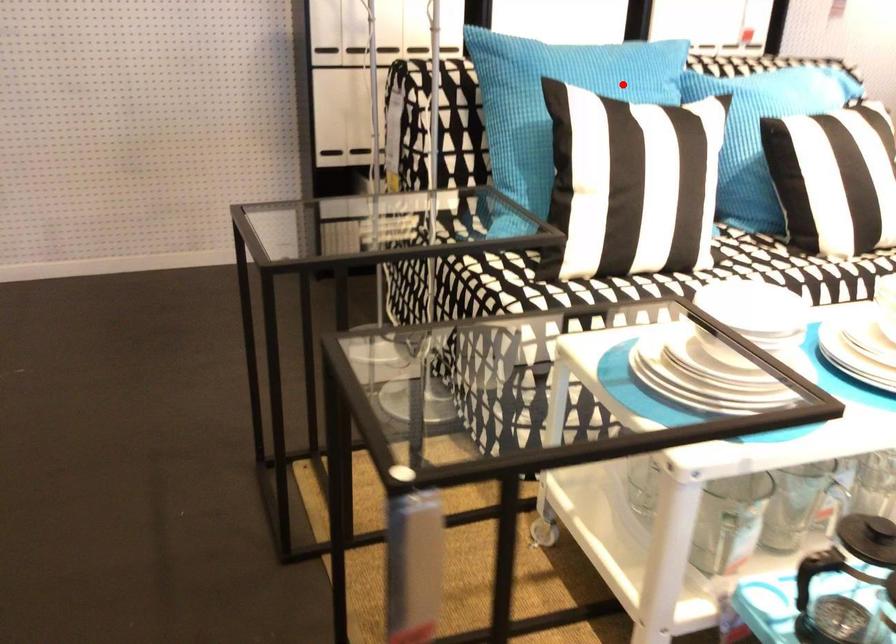
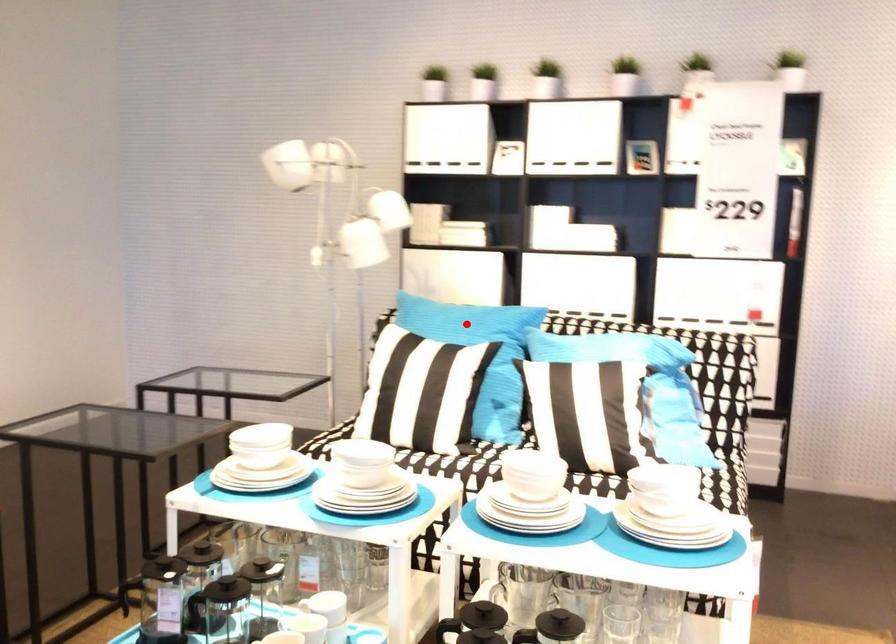
I am providing you with two images of the same scene from different viewpoints. A red point is marked on the first image and another point is marked on the second image. Does the point marked in image1 correspond to the same location as the one in image2?

Yes